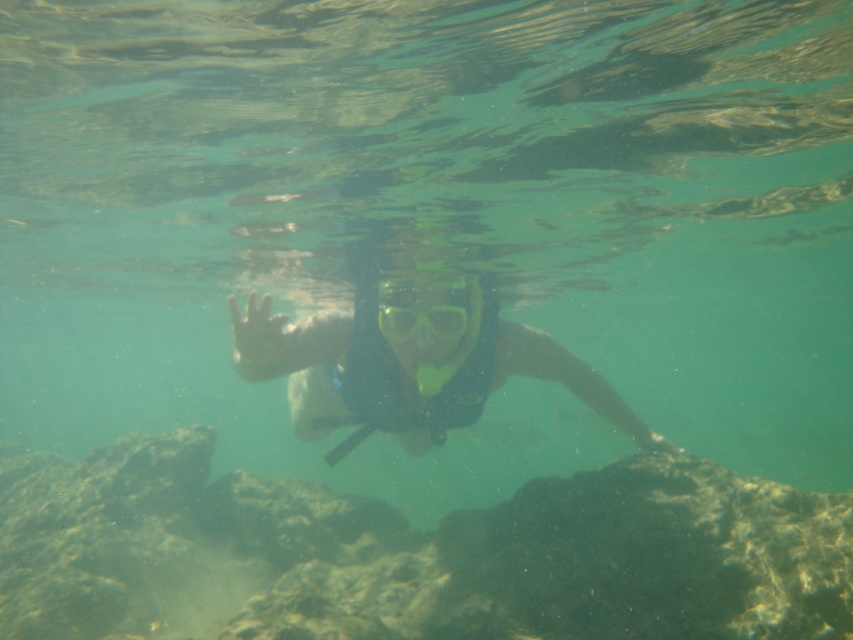
Question: Can you confirm if transparent rubber snorkel at center is positioned to the left of transparent plastic goggles at center?

Choices:
 (A) no
 (B) yes

Answer: (A)

Question: Can you confirm if transparent rubber snorkel at center is positioned to the right of transparent plastic goggles at center?

Choices:
 (A) yes
 (B) no

Answer: (A)

Question: Which point appears farthest from the camera in this image?

Choices:
 (A) (454, 316)
 (B) (297, 332)

Answer: (A)

Question: Is transparent rubber snorkel at center closer to the viewer compared to transparent plastic goggles at center?

Choices:
 (A) yes
 (B) no

Answer: (A)

Question: Which point is closer to the camera?

Choices:
 (A) (279, 362)
 (B) (393, 316)

Answer: (A)